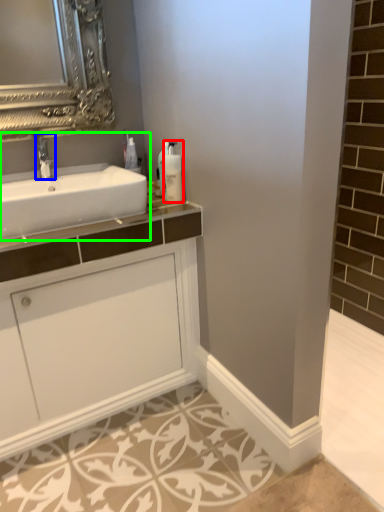
Question: Estimate the real-world distances between objects in this image. Which object is closer to soap dispenser (highlighted by a red box), tap (highlighted by a blue box) or sink (highlighted by a green box)?

Choices:
 (A) tap
 (B) sink

Answer: (B)